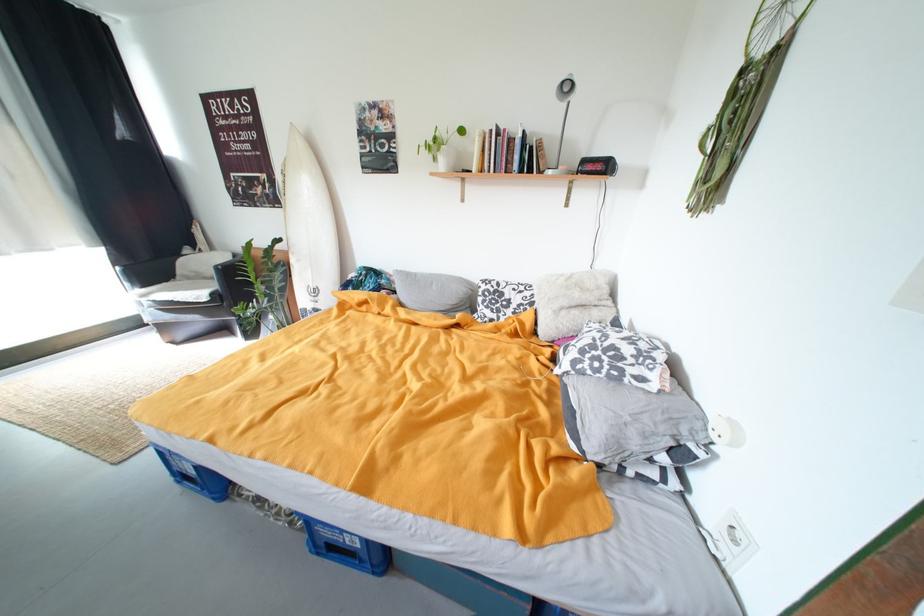
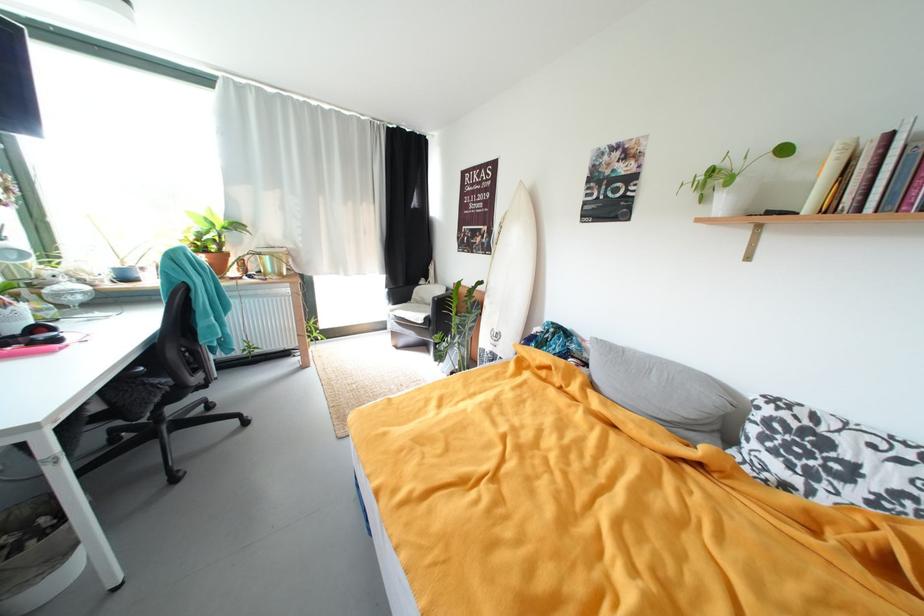
The point at (517, 313) is marked in the first image. Where is the corresponding point in the second image?

(861, 493)